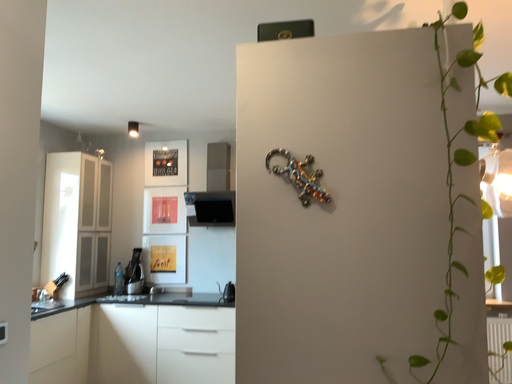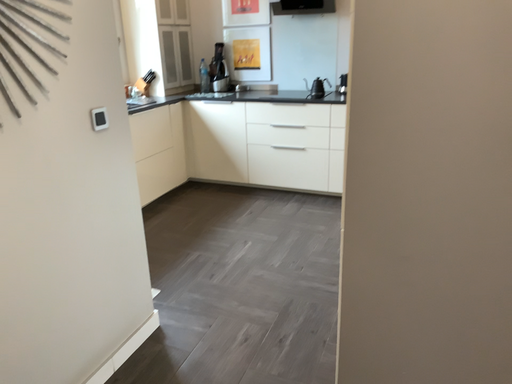
Question: How did the camera likely rotate when shooting the video?

Choices:
 (A) rotated upward
 (B) rotated downward

Answer: (B)